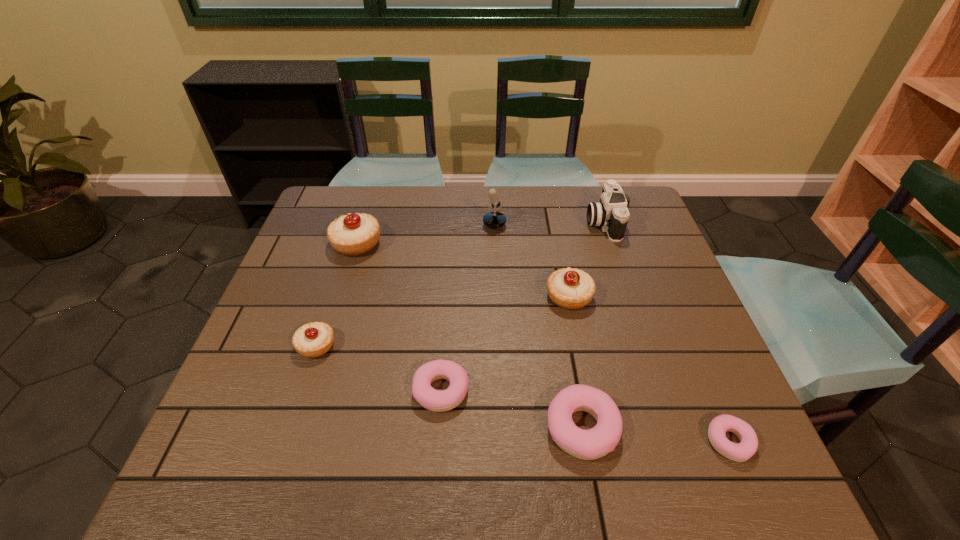
At what (x,y) coordinates should I click in order to perform the action: click on object at the near right corner. Please return your answer as a coordinate pair (x, y). The height and width of the screenshot is (540, 960). Looking at the image, I should click on (748, 445).

Identify the location of free spot at the far edge of the desktop. The width and height of the screenshot is (960, 540). (538, 190).

The width and height of the screenshot is (960, 540). Find the location of `free location at the near edge`. free location at the near edge is located at coordinates (357, 484).

In the image, there is a desktop. Where is `vacant space at the left edge`? Image resolution: width=960 pixels, height=540 pixels. vacant space at the left edge is located at coordinates tap(257, 366).

The image size is (960, 540). In order to click on free location at the right edge in this screenshot , I will do `click(659, 238)`.

This screenshot has width=960, height=540. What are the coordinates of `free space at the far left corner of the desktop` in the screenshot? It's located at (317, 224).

Where is `vacant space at the near left corner of the desktop`? Image resolution: width=960 pixels, height=540 pixels. vacant space at the near left corner of the desktop is located at coordinates (223, 461).

At what (x,y) coordinates should I click in order to perform the action: click on free space at the near right corner. Please return your answer as a coordinate pair (x, y). Looking at the image, I should click on (702, 490).

This screenshot has height=540, width=960. What are the coordinates of `free space between the fourth pastry from right to left and the fifth nearest pastry` in the screenshot? It's located at (505, 343).

The image size is (960, 540). Find the location of `vacant space that's between the fourth pastry from right to left and the second pink pastry from right to left`. vacant space that's between the fourth pastry from right to left and the second pink pastry from right to left is located at coordinates (512, 409).